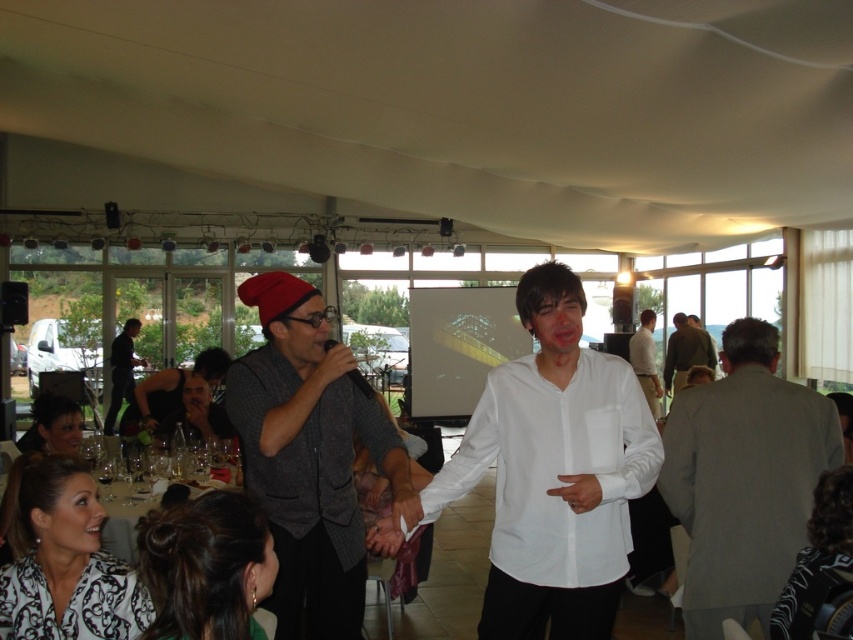
Question: Is white printed blouse at lower left bigger than matte black beanie at left?

Choices:
 (A) no
 (B) yes

Answer: (A)

Question: Which point is closer to the camera?

Choices:
 (A) matte gray shirt at center
 (B) black and white striped shirt at lower right
 (C) green fabric shirt at center

Answer: (B)

Question: Where is white printed blouse at lower left located in relation to matte black beanie at left in the image?

Choices:
 (A) above
 (B) below

Answer: (A)

Question: Does matte gray shirt at center appear under matte black beanie at left?

Choices:
 (A) yes
 (B) no

Answer: (B)

Question: Which object is the closest to the matte black beanie at left?

Choices:
 (A) white shirt at center
 (B) white smooth shirt at center
 (C) matte black hair at lower left
 (D) green fabric shirt at center

Answer: (C)

Question: Which point appears closest to the camera in this image?

Choices:
 (A) (682, 358)
 (B) (273, 556)
 (C) (33, 422)
 (D) (114, 388)

Answer: (B)